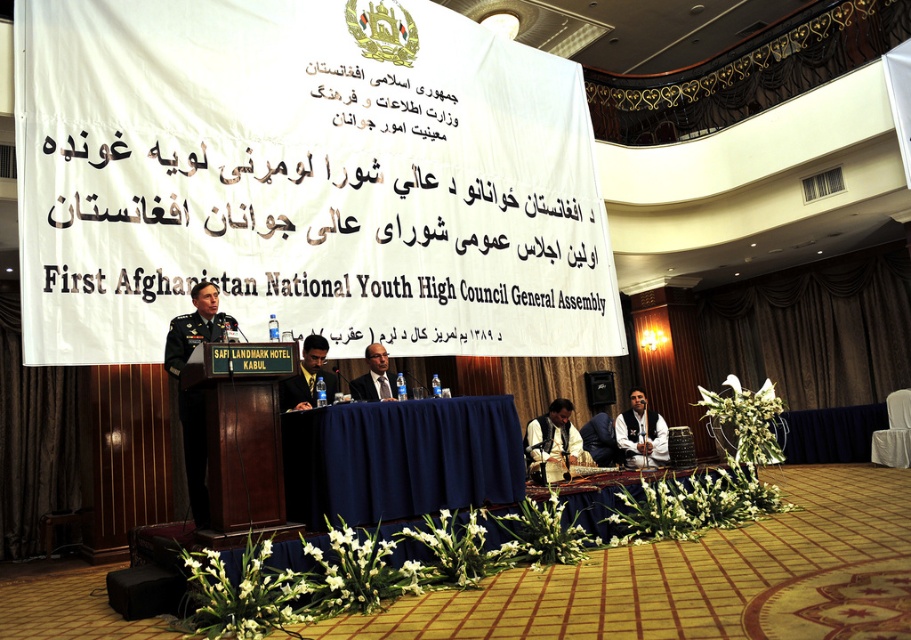
You are attending the event and need to locate the blue fabric table at center and the green military uniform at left. From the perspective of someone facing the stage, which object is positioned to the right?

The blue fabric table at center is to the right of the green military uniform at left.

You are attending the First Afghanistan National Youth High Council General Assembly at the Safi Landmark Hotel in Kabul. You notice two points marked on the stage. The first point is at coordinates point (548, 426), and the second point is at point (385, 392). From your perspective in the audience, which point is located further back on the stage?

Point (548, 426) is behind point (385, 392), so it is further back on the stage.